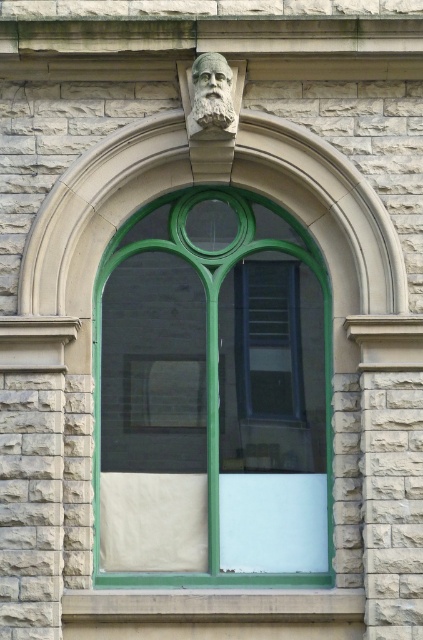
You are standing in front of the window and want to touch both points on the window frame. Which point, point (208, 220) or point (343, 609), is closer to you?

Point (208, 220) is closer to you because it is further to the viewer than point (343, 609).

You are standing in front of the window and want to touch both the green glass window at center and the stone carved bust at upper center. Which object can you reach first as you move forward?

The green glass window at center is closer to you than the stone carved bust at upper center, so you can reach it first.

Looking at this image, you are a window cleaner with a ladder that can reach up to 100 centimeters. You need to clean the green glass window at center and the smooth concrete window sill at center. Can your ladder reach both areas from the same spot?

The distance between the green glass window at center and the smooth concrete window sill at center is 99.63 centimeters. Since the ladder can reach up to 100 centimeters, it can reach both areas from the same spot as the distance is just under the maximum reach.